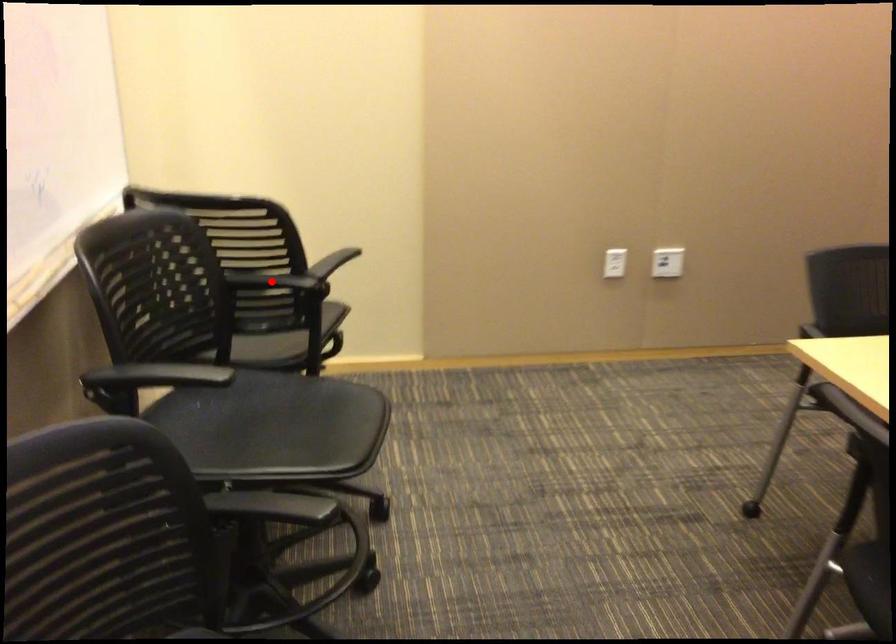
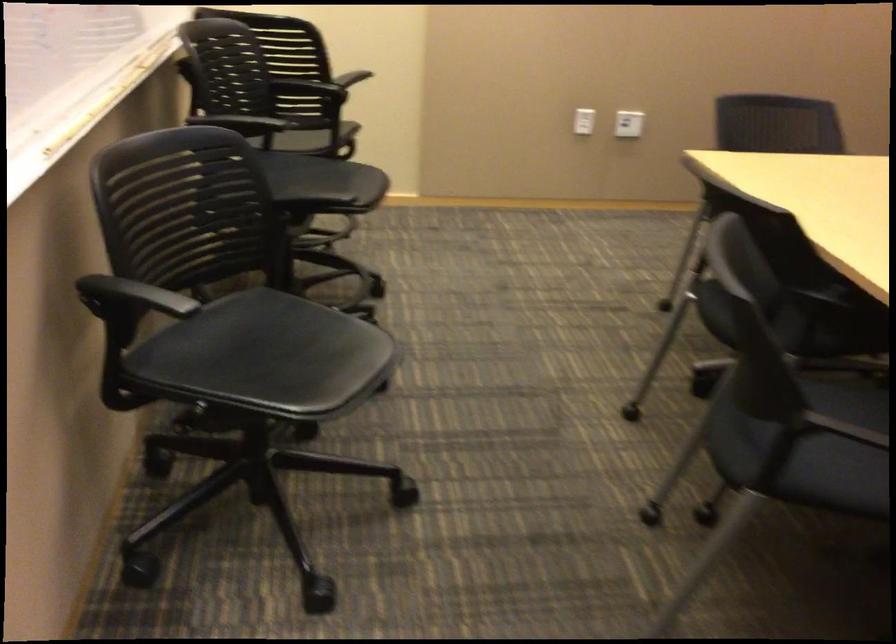
Question: I am providing you with two images of the same scene from different viewpoints. A red point is marked on the first image. Can you still see the location of the red point in image 2?

Choices:
 (A) Yes
 (B) No

Answer: (B)